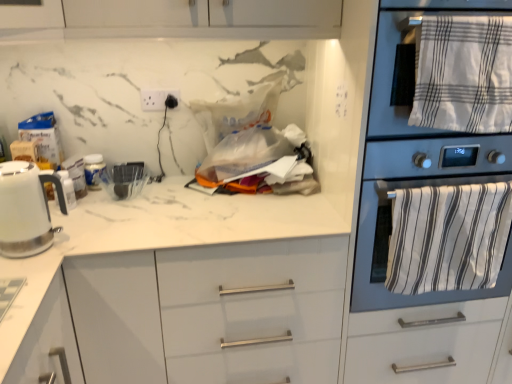
Question: Is white plastic electric outlet at upper center completely or partially inside white striped towel at right, which is counted as the first bath towel, starting from the bottom?

Choices:
 (A) yes
 (B) no

Answer: (B)

Question: From the image's perspective, is white striped towel at right, which is counted as the first bath towel, starting from the bottom, over white plastic electric outlet at upper center?

Choices:
 (A) no
 (B) yes

Answer: (A)

Question: Can you confirm if white striped towel at right, which is counted as the first bath towel, starting from the bottom, is wider than white plastic electric outlet at upper center?

Choices:
 (A) yes
 (B) no

Answer: (A)

Question: Does white striped towel at right, which is counted as the first bath towel, starting from the bottom, have a smaller size compared to white plastic electric outlet at upper center?

Choices:
 (A) yes
 (B) no

Answer: (B)

Question: From the image's perspective, does white striped towel at right, which appears as the 2th bath towel when viewed from the top, appear lower than white plastic electric outlet at upper center?

Choices:
 (A) yes
 (B) no

Answer: (A)

Question: Is there a large distance between white striped towel at right, which appears as the 2th bath towel when viewed from the top, and white plastic electric outlet at upper center?

Choices:
 (A) yes
 (B) no

Answer: (A)

Question: Are metallic oven at right and white glossy electric kettle at left making contact?

Choices:
 (A) no
 (B) yes

Answer: (A)

Question: Is metallic oven at right to the left of white glossy electric kettle at left from the viewer's perspective?

Choices:
 (A) yes
 (B) no

Answer: (B)

Question: Can you confirm if metallic oven at right is thinner than white glossy electric kettle at left?

Choices:
 (A) no
 (B) yes

Answer: (A)

Question: Is metallic oven at right turned away from white glossy electric kettle at left?

Choices:
 (A) yes
 (B) no

Answer: (B)

Question: Can you confirm if metallic oven at right is bigger than white glossy electric kettle at left?

Choices:
 (A) no
 (B) yes

Answer: (B)

Question: From the image's perspective, is metallic oven at right located above white glossy electric kettle at left?

Choices:
 (A) no
 (B) yes

Answer: (B)

Question: Is white marble countertop at center shorter than white striped towel at upper right, placed as the 2th bath towel when sorted from bottom to top?

Choices:
 (A) no
 (B) yes

Answer: (A)